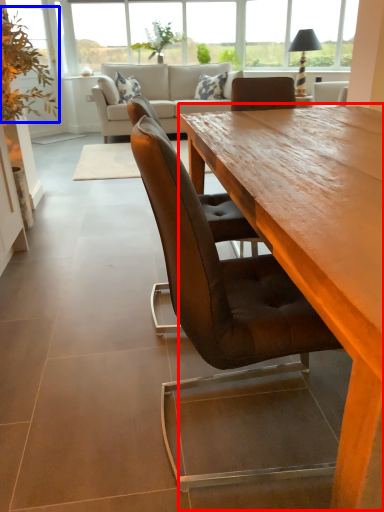
Question: Which point is further to the camera, coffee table (highlighted by a red box) or plant (highlighted by a blue box)?

Choices:
 (A) coffee table
 (B) plant

Answer: (B)